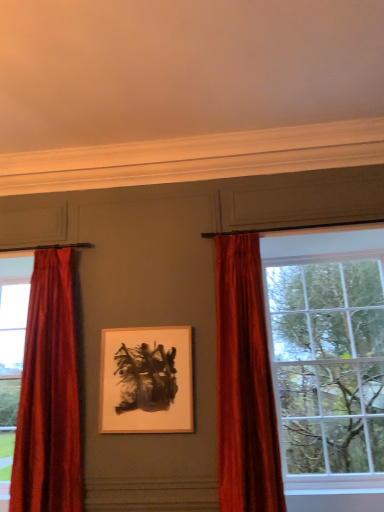
Question: From the image's perspective, is velvet red curtain at left, which is the 1th curtain from left to right, under matte white picture frame at center?

Choices:
 (A) no
 (B) yes

Answer: (A)

Question: Considering the relative sizes of velvet red curtain at left, arranged as the second curtain when viewed from the right, and matte white picture frame at center in the image provided, is velvet red curtain at left, arranged as the second curtain when viewed from the right, shorter than matte white picture frame at center?

Choices:
 (A) no
 (B) yes

Answer: (A)

Question: Is velvet red curtain at left, which is the 1th curtain from left to right, bigger than matte white picture frame at center?

Choices:
 (A) yes
 (B) no

Answer: (A)

Question: Is the position of velvet red curtain at left, arranged as the second curtain when viewed from the right, more distant than that of matte white picture frame at center?

Choices:
 (A) no
 (B) yes

Answer: (A)

Question: Is velvet red curtain at left, which is the 1th curtain from left to right, thinner than matte white picture frame at center?

Choices:
 (A) no
 (B) yes

Answer: (A)

Question: Is velvet red curtain at left, arranged as the second curtain when viewed from the right, not inside matte white picture frame at center?

Choices:
 (A) yes
 (B) no

Answer: (A)

Question: Is matte white picture frame at center at the left side of velvet red curtain at left, which is the 1th curtain from left to right?

Choices:
 (A) yes
 (B) no

Answer: (B)

Question: Can you confirm if matte white picture frame at center is wider than velvet red curtain at left, arranged as the second curtain when viewed from the right?

Choices:
 (A) yes
 (B) no

Answer: (B)

Question: Does matte white picture frame at center touch velvet red curtain at left, arranged as the second curtain when viewed from the right?

Choices:
 (A) no
 (B) yes

Answer: (A)

Question: Would you say velvet red curtain at left, arranged as the second curtain when viewed from the right, is part of matte white picture frame at center's contents?

Choices:
 (A) no
 (B) yes

Answer: (A)

Question: Is matte white picture frame at center located outside velvet red curtain at left, which is the 1th curtain from left to right?

Choices:
 (A) yes
 (B) no

Answer: (A)

Question: Does matte white picture frame at center appear on the right side of velvet red curtain at left, arranged as the second curtain when viewed from the right?

Choices:
 (A) no
 (B) yes

Answer: (B)

Question: Can you confirm if matte glass window at right is thinner than matte white picture frame at center?

Choices:
 (A) no
 (B) yes

Answer: (A)